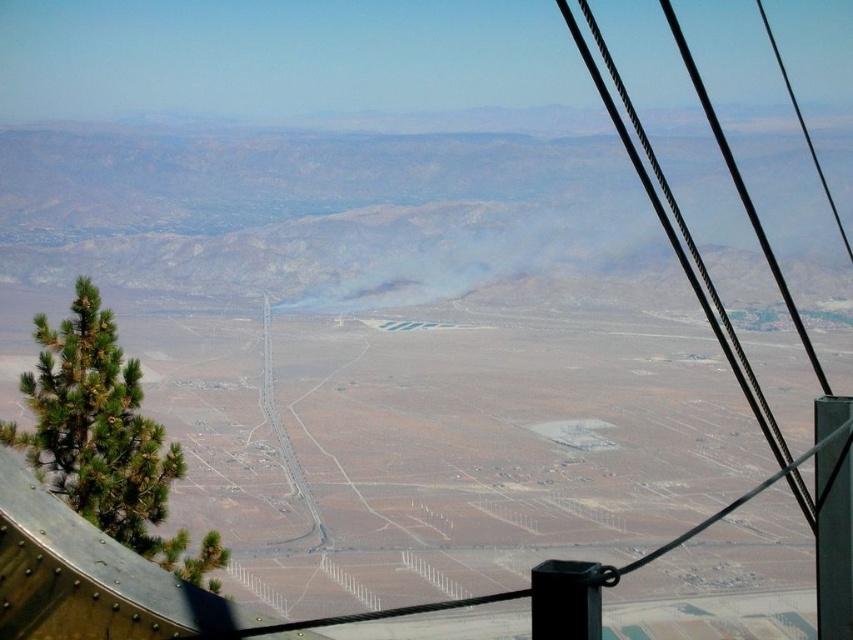
You are a tourist in the cable car and want to take a photo of the brown rocky mountain at center and the black metal pole at right. Which object will appear larger in the photo?

The brown rocky mountain at center will appear larger in the photo because it is bigger than the black metal pole at right.

You are inside a cable car moving through a desert. You notice two objects outside the window on the right side. Which one is positioned more to the right between the metallic wire at right and the black metal pole at right?

The metallic wire at right is positioned more to the right than the black metal pole at right according to the description.